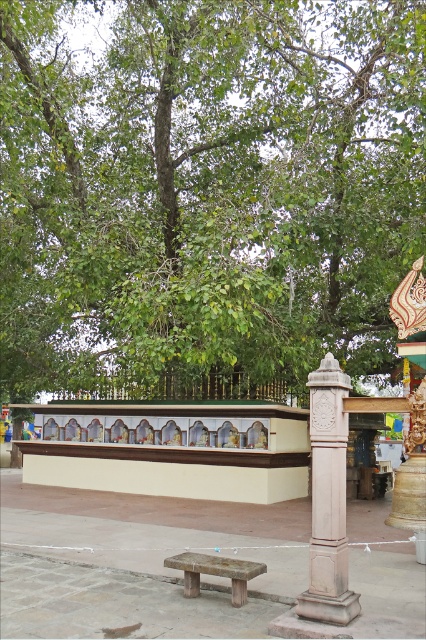
Does green leafy tree at upper center have a greater width compared to white stone column at right?

A: Correct, the width of green leafy tree at upper center exceeds that of white stone column at right.

Who is positioned more to the left, green leafy tree at upper center or white stone column at right?

Positioned to the left is green leafy tree at upper center.

Is point (244, 266) positioned after point (333, 461)?

Yes, it is.

Where is `green leafy tree at upper center`? green leafy tree at upper center is located at coordinates (207, 182).

Is white stone column at right smaller than wooden bench at center?

No.

This screenshot has height=640, width=426. I want to click on white stone column at right, so click(x=328, y=499).

Between point (383, 84) and point (187, 570), which one is positioned in front?

Point (187, 570)

Is point (371, 317) farther from viewer compared to point (215, 573)?

Yes, point (371, 317) is farther from viewer.

Which is behind, point (302, 140) or point (250, 573)?

The point (302, 140) is behind.

Where is `green leafy tree at upper center`? green leafy tree at upper center is located at coordinates (207, 182).